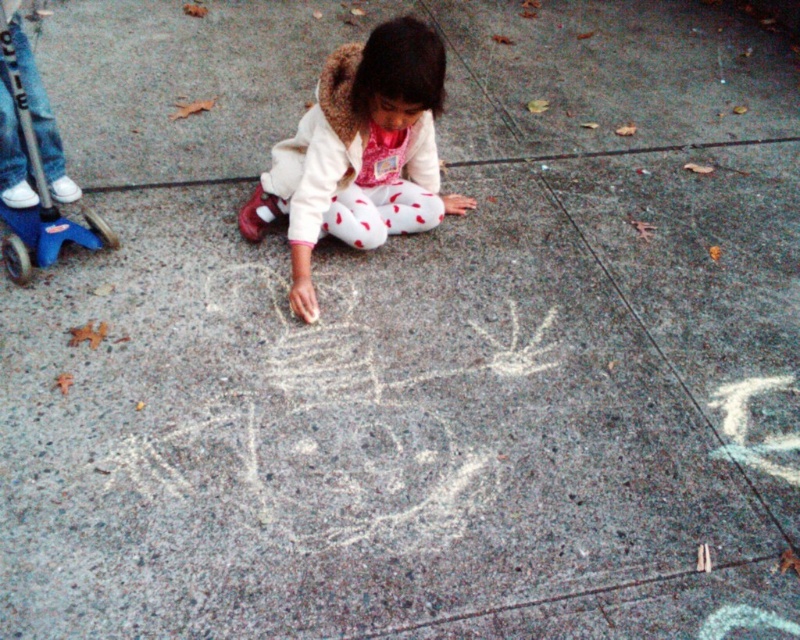
Is point (401, 118) less distant than point (22, 264)?

Yes, it is in front of point (22, 264).

Looking at this image, who is more forward, (381, 74) or (14, 80)?

Positioned in front is point (381, 74).

Locate an element on the screen. The height and width of the screenshot is (640, 800). white soft fabric at center is located at coordinates (360, 154).

Who is shorter, white chalk drawing at center or white soft fabric at center?

white chalk drawing at center is shorter.

Based on the photo, can you confirm if white chalk drawing at center is positioned below white soft fabric at center?

Yes, white chalk drawing at center is below white soft fabric at center.

The image size is (800, 640). In order to click on white chalk drawing at center in this screenshot , I will do `click(326, 424)`.

The width and height of the screenshot is (800, 640). Describe the element at coordinates (326, 424) in the screenshot. I see `white chalk drawing at center` at that location.

At what (x,y) coordinates should I click in order to perform the action: click on white chalk drawing at center. Please return your answer as a coordinate pair (x, y). The image size is (800, 640). Looking at the image, I should click on (326, 424).